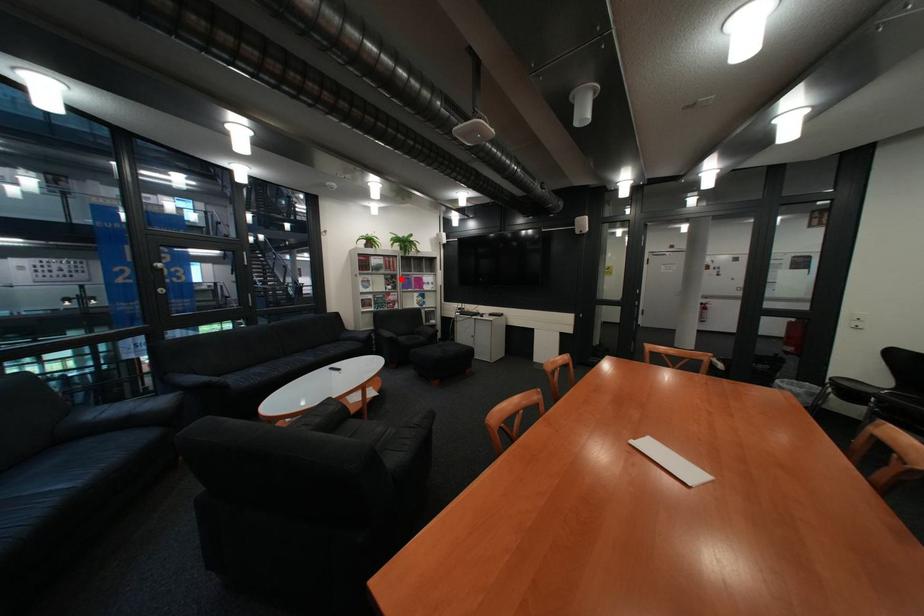
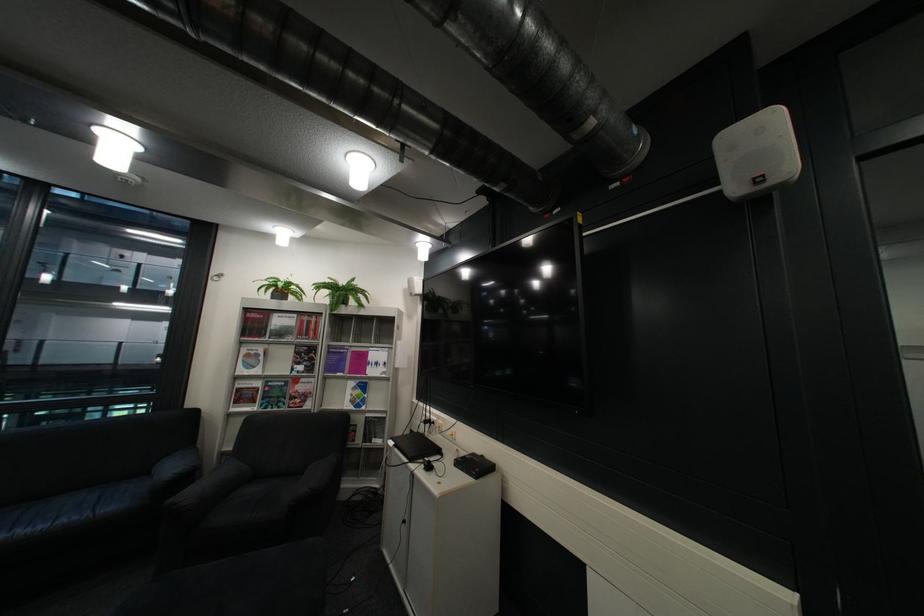
In the second image, find the point that corresponds to the highlighted location in the first image.

(311, 353)